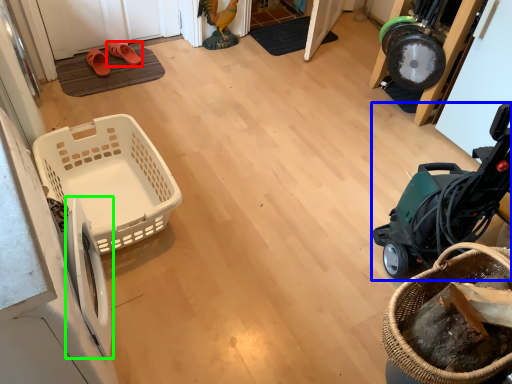
Question: Based on their relative distances, which object is farther from footwear (highlighted by a red box)? Choose from baby carriage (highlighted by a blue box) and washing machine (highlighted by a green box).

Choices:
 (A) baby carriage
 (B) washing machine

Answer: (A)